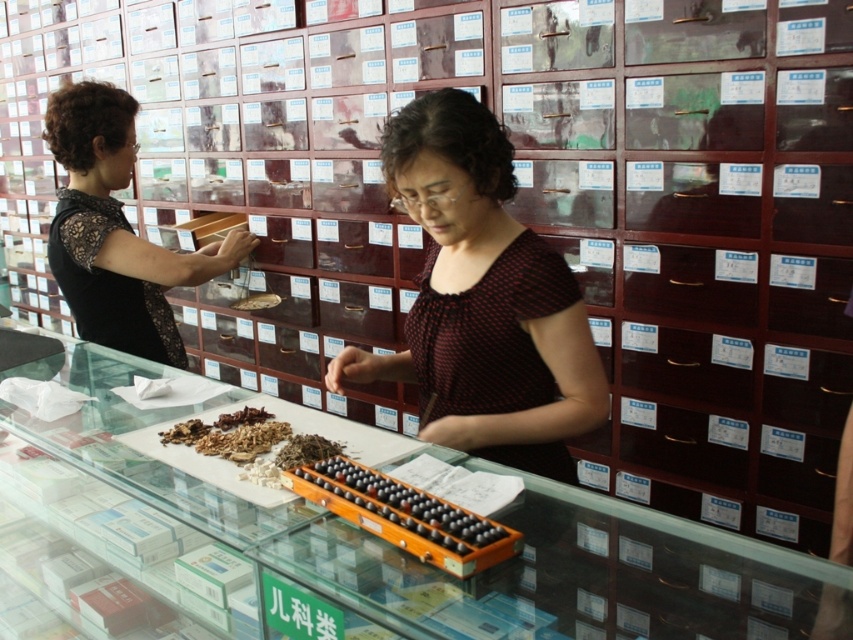
Question: Is wooden abacus at center to the right of brown crumbly herbs at center from the viewer's perspective?

Choices:
 (A) yes
 (B) no

Answer: (A)

Question: Which object appears farthest from the camera in this image?

Choices:
 (A) wooden abacus at center
 (B) brown crumbly herbs at center

Answer: (B)

Question: Can you confirm if matte black dress at left is positioned above brown crumbly herbs at center?

Choices:
 (A) yes
 (B) no

Answer: (A)

Question: Among these objects, which one is farthest from the camera?

Choices:
 (A) brown crumbly herbs at center
 (B) wooden abacus at center
 (C) dark red dotted blouse at center

Answer: (C)

Question: Where is wooden abacus at center located in relation to brown crumbly herbs at center in the image?

Choices:
 (A) above
 (B) below

Answer: (B)

Question: Among these objects, which one is nearest to the camera?

Choices:
 (A) brown crumbly herbs at center
 (B) dark red dotted blouse at center
 (C) wooden abacus at center
 (D) matte black dress at left

Answer: (C)